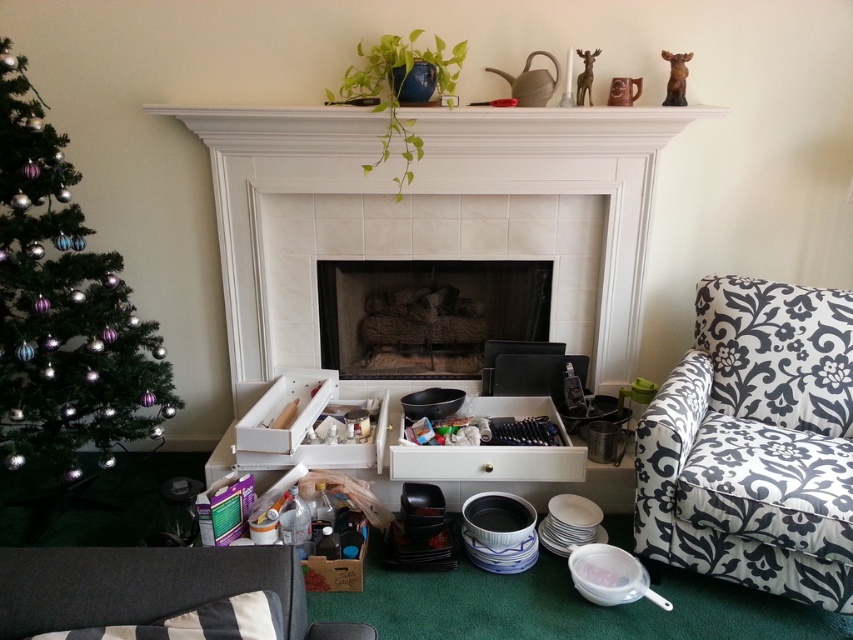
Between green matte christmas tree at left and dark gray fabric couch at lower left, which one appears on the right side from the viewer's perspective?

From the viewer's perspective, dark gray fabric couch at lower left appears more on the right side.

Is point (169, 404) less distant than point (270, 564)?

No, it is behind (270, 564).

The height and width of the screenshot is (640, 853). Describe the element at coordinates (62, 307) in the screenshot. I see `green matte christmas tree at left` at that location.

Identify the location of green matte christmas tree at left. (62, 307).

Who is positioned more to the left, black floral fabric armchair at right or green matte christmas tree at left?

green matte christmas tree at left

Is black floral fabric armchair at right further to the viewer compared to green matte christmas tree at left?

No, it is in front of green matte christmas tree at left.

You are a GUI agent. You are given a task and a screenshot of the screen. Output one action in this format:
    pyautogui.click(x=<x>, y=<y>)
    Task: Click on the black floral fabric armchair at right
    This screenshot has height=640, width=853.
    Given the screenshot: What is the action you would take?
    pyautogui.click(x=755, y=444)

Consider the image. Is black floral fabric armchair at right in front of dark gray fabric couch at lower left?

No, it is not.

Is point (694, 333) in front of point (3, 573)?

No, it is behind (3, 573).

Where is `black floral fabric armchair at right`? This screenshot has height=640, width=853. black floral fabric armchair at right is located at coordinates (755, 444).